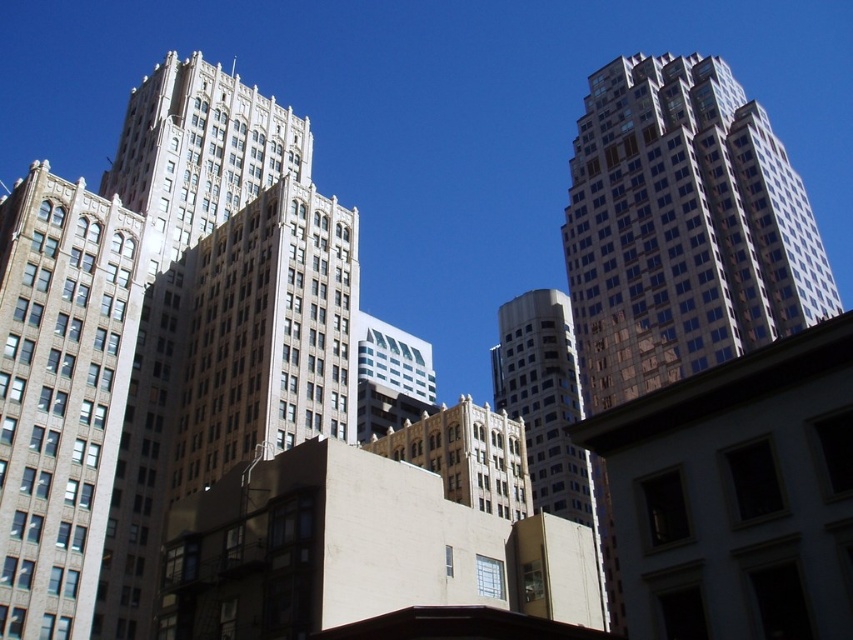
Between point (592, 116) and point (28, 477), which one is positioned in front?

Point (28, 477) is more forward.

Does reflective glass skyscraper at right appear on the right side of brown brick building at left?

Indeed, reflective glass skyscraper at right is positioned on the right side of brown brick building at left.

The height and width of the screenshot is (640, 853). In order to click on reflective glass skyscraper at right in this screenshot , I will do `click(682, 228)`.